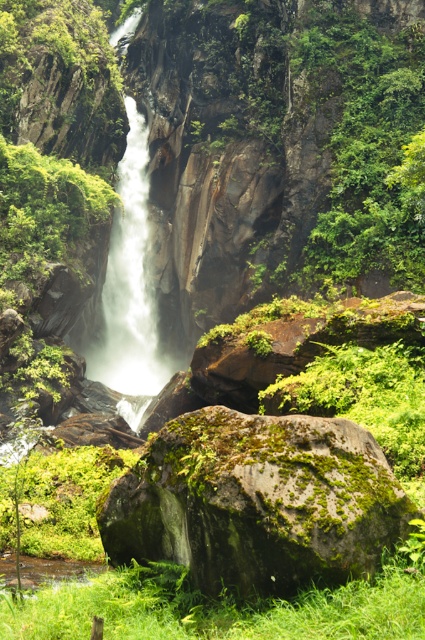
Is green mossy rock at center further to the viewer compared to white frothy water at center?

No, green mossy rock at center is closer to the viewer.

Is green mossy rock at center below white frothy water at center?

Correct, green mossy rock at center is located below white frothy water at center.

The width and height of the screenshot is (425, 640). I want to click on green mossy rock at center, so click(x=257, y=500).